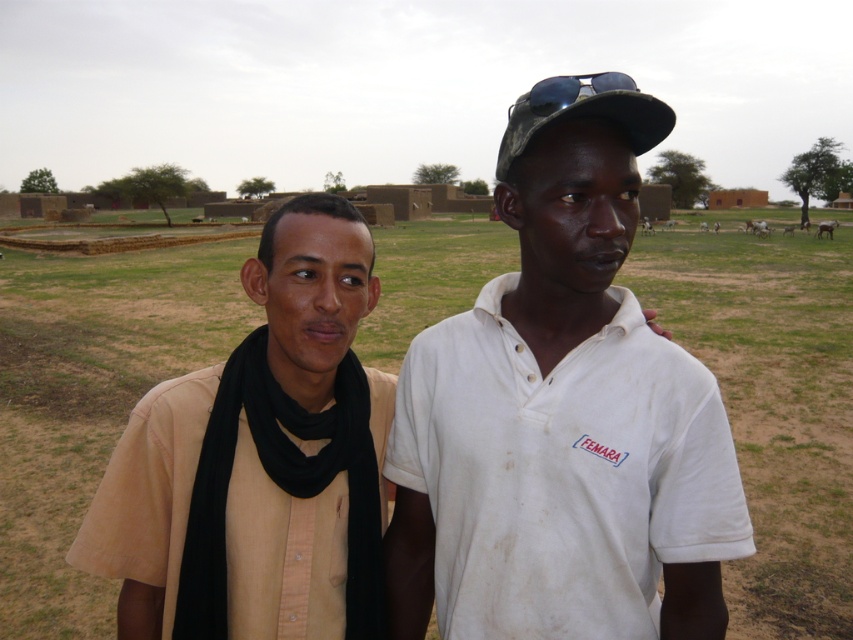
Question: Which of the following is the farthest from the observer?

Choices:
 (A) click(x=321, y=444)
 (B) click(x=554, y=324)
 (C) click(x=38, y=307)

Answer: (C)

Question: From the image, what is the correct spatial relationship of white cotton shirt at center in relation to camouflage fabric baseball cap at upper center?

Choices:
 (A) right
 (B) left

Answer: (B)

Question: Considering the real-world distances, which object is farthest from the beige fabric shirt at center?

Choices:
 (A) white cotton shirt at center
 (B) beige cotton shirt at left
 (C) camouflage fabric baseball cap at upper center

Answer: (C)

Question: Observing the image, what is the correct spatial positioning of beige cotton shirt at left in reference to camouflage fabric baseball cap at upper center?

Choices:
 (A) above
 (B) below

Answer: (B)

Question: Does white cotton shirt at center have a larger size compared to camouflage fabric baseball cap at upper center?

Choices:
 (A) yes
 (B) no

Answer: (B)

Question: Which object is the closest to the camouflage fabric baseball cap at upper center?

Choices:
 (A) beige fabric shirt at center
 (B) beige cotton shirt at left

Answer: (B)